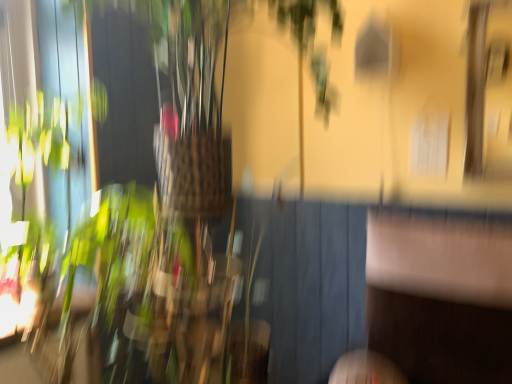
Locate an element on the screen. brown leather couch at lower right is located at coordinates (440, 296).

Measure the distance between brown leather couch at lower right and camera.

A distance of 1.51 meters exists between brown leather couch at lower right and camera.

Describe the element at coordinates (440, 296) in the screenshot. The image size is (512, 384). I see `brown leather couch at lower right` at that location.

Locate an element on the screen. brown leather couch at lower right is located at coordinates (440, 296).